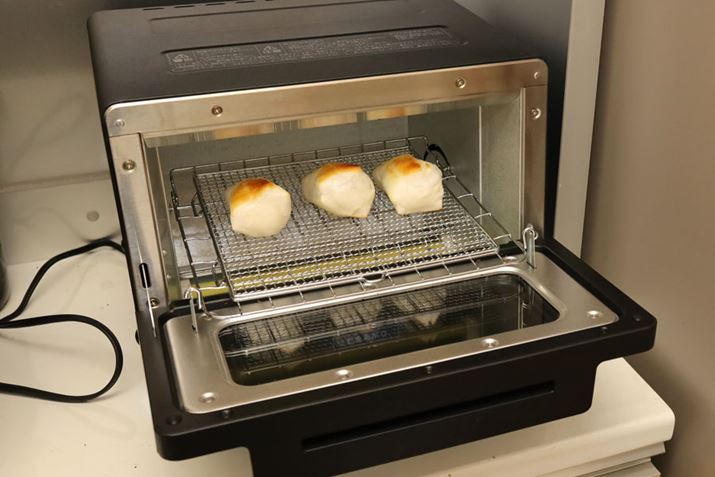
At what (x,y) coordinates should I click in order to perform the action: click on counter. Please return your answer as a coordinate pair (x, y). The width and height of the screenshot is (715, 477). Looking at the image, I should click on click(x=104, y=443), click(x=94, y=288), click(x=643, y=409).